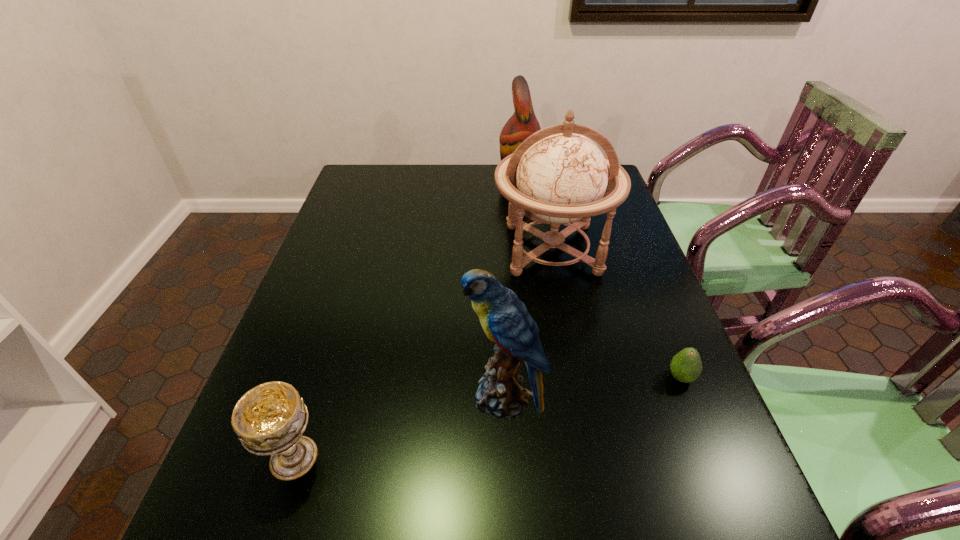
Locate an element on the screen. This screenshot has height=540, width=960. free spot between the globe and the leftmost object is located at coordinates (423, 354).

You are a GUI agent. You are given a task and a screenshot of the screen. Output one action in this format:
    pyautogui.click(x=<x>, y=<y>)
    Task: Click on the vacant space that's between the rightmost object and the globe
    Image resolution: width=960 pixels, height=540 pixels.
    Given the screenshot: What is the action you would take?
    pyautogui.click(x=616, y=313)

Where is `free spot between the farther parrot and the shortest object`? The image size is (960, 540). free spot between the farther parrot and the shortest object is located at coordinates (601, 278).

Image resolution: width=960 pixels, height=540 pixels. I want to click on object that is the nearest to the farther parrot, so click(556, 176).

Locate an element on the screen. Image resolution: width=960 pixels, height=540 pixels. the fourth closest object to the rightmost object is located at coordinates (523, 123).

Locate an element on the screen. This screenshot has width=960, height=540. free location that satisfies the following two spatial constraints: 1. on the face of the farther parrot; 2. on the right side of the avocado is located at coordinates (547, 377).

Find the location of a particular element. This screenshot has width=960, height=540. vacant space that satisfies the following two spatial constraints: 1. on the face of the farthest object; 2. on the left side of the shortest object is located at coordinates (547, 377).

At what (x,y) coordinates should I click in order to perform the action: click on free spot that satisfies the following two spatial constraints: 1. on the front-facing side of the fourth nearest object; 2. on the face of the nearer parrot. Please return your answer as a coordinate pair (x, y). This screenshot has height=540, width=960. Looking at the image, I should click on [581, 397].

The width and height of the screenshot is (960, 540). In order to click on vacant space that satisfies the following two spatial constraints: 1. on the front-facing side of the globe; 2. on the left side of the shortest object in this screenshot , I will do `click(577, 377)`.